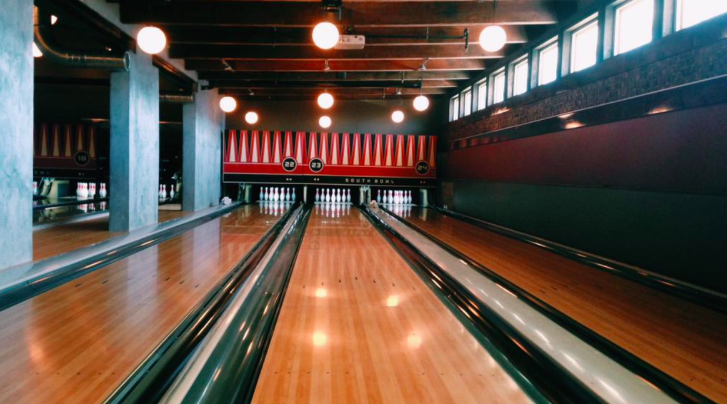
Identify the location of lights. (140, 36), (222, 101), (252, 116), (326, 124), (326, 106), (326, 31), (494, 38), (425, 100), (401, 116).